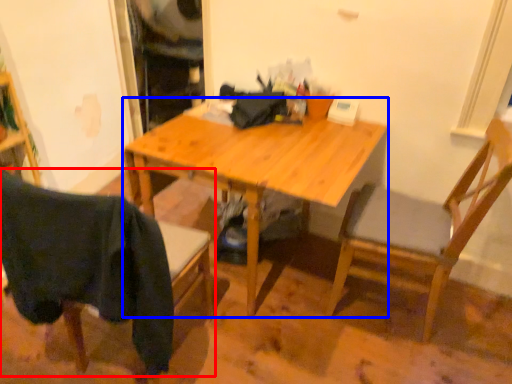
Question: Which object is closer to the camera taking this photo, chair (highlighted by a red box) or desk (highlighted by a blue box)?

Choices:
 (A) chair
 (B) desk

Answer: (A)